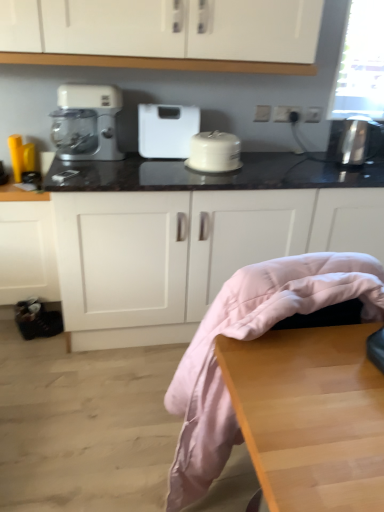
Question: From the image's perspective, is white plastic scale at center located above or below black marble countertop at center?

Choices:
 (A) above
 (B) below

Answer: (A)

Question: Is point (150, 139) positioned closer to the camera than point (145, 178)?

Choices:
 (A) farther
 (B) closer

Answer: (A)

Question: Which object is positioned farthest from the matte yellow kettle at left, which is the second appliance from right to left?

Choices:
 (A) satin silver toaster at right, which is the 1th appliance from right to left
 (B) black marble countertop at center
 (C) wooden table at lower right
 (D) white plastic scale at center
 (E) white glossy cake stand at center

Answer: (C)

Question: Based on their relative distances, which object is nearer to the wooden table at lower right?

Choices:
 (A) white plastic scale at center
 (B) satin silver toaster at right, which is the 1th appliance from right to left
 (C) white glossy cake stand at center
 (D) black marble countertop at center
 (E) matte yellow kettle at left, marked as the first appliance in a left-to-right arrangement

Answer: (D)